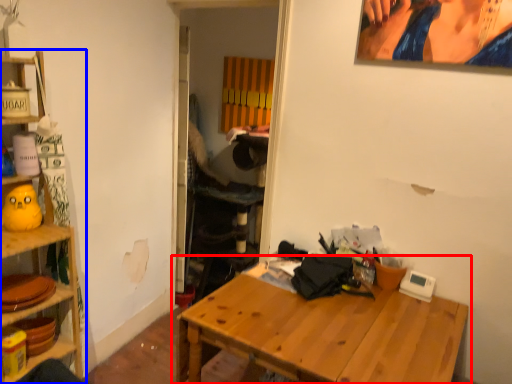
Question: Which object appears closest to the camera in this image, table (highlighted by a red box) or shelf (highlighted by a blue box)?

Choices:
 (A) table
 (B) shelf

Answer: (A)